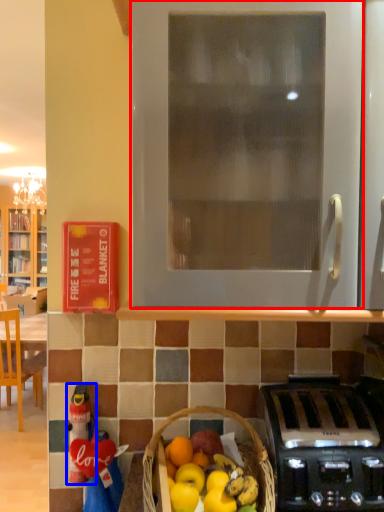
Question: Which point is closer to the camera, oven (highlighted by a red box) or toy (highlighted by a blue box)?

Choices:
 (A) oven
 (B) toy

Answer: (A)